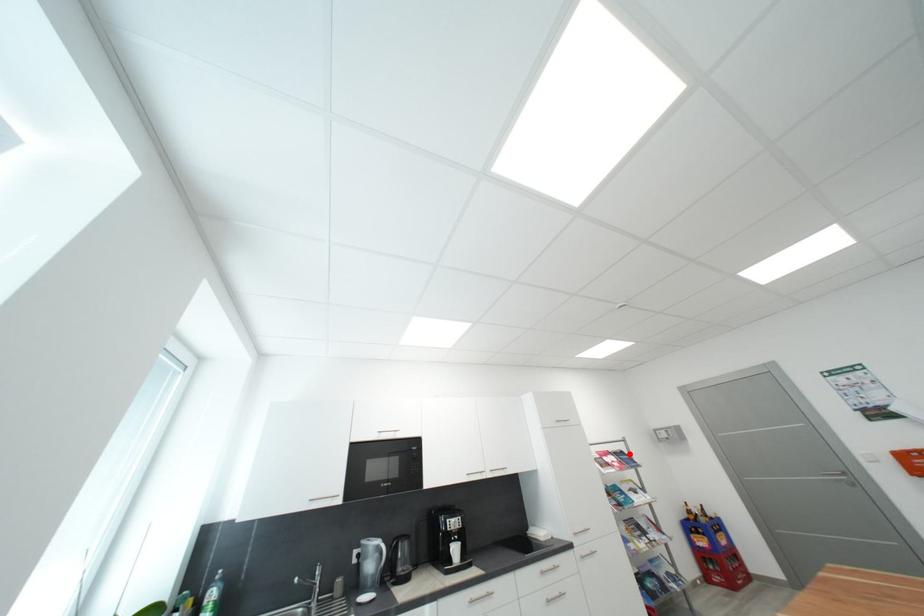
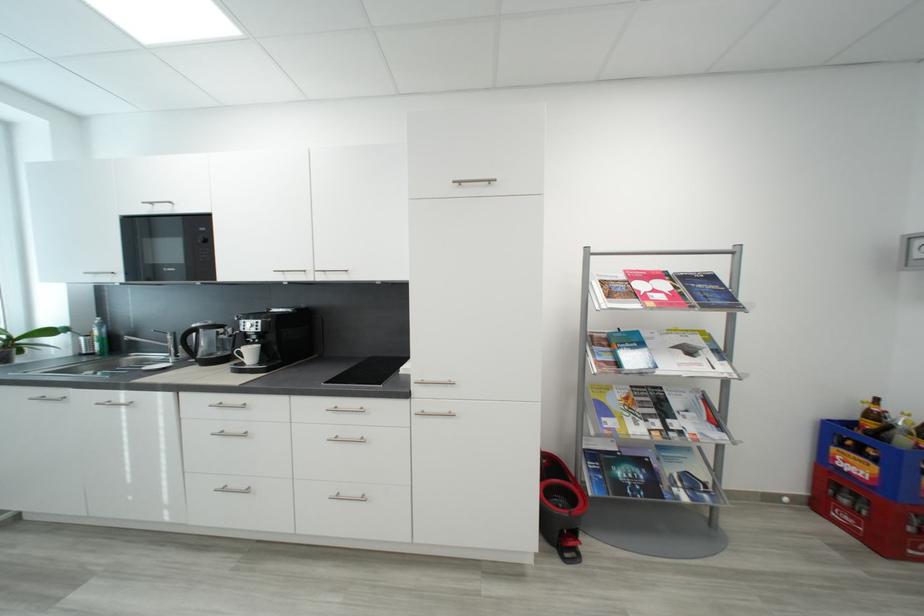
Question: I am providing you with two images of the same scene from different viewpoints. A red point is shown in image1. For the corresponding object point in image2, is it positioned nearer or farther from the camera?

Choices:
 (A) Nearer
 (B) Farther

Answer: (A)